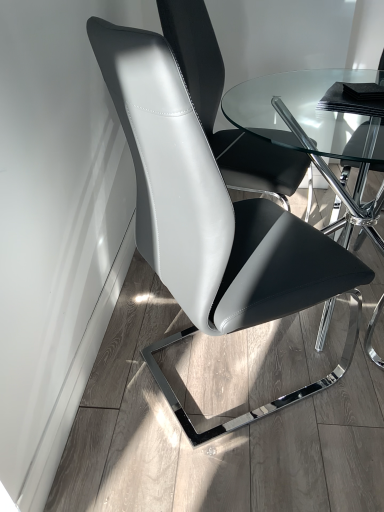
Identify the location of free spot in front of matte black chair at center, positioned as the second chair in back-to-front order. The width and height of the screenshot is (384, 512). (248, 466).